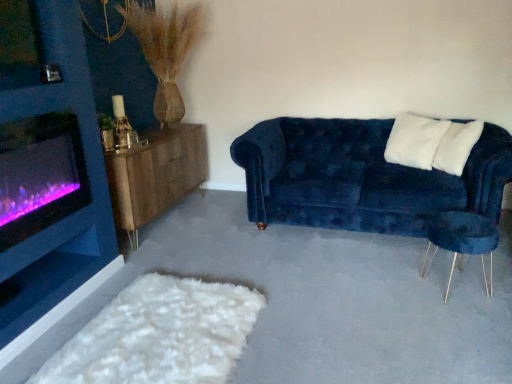
Question: Is velvet blue couch at right not near white soft pillow at upper right, the second pillow positioned from the right?

Choices:
 (A) no
 (B) yes

Answer: (A)

Question: Can you confirm if velvet blue couch at right is taller than white soft pillow at upper right, arranged as the 1th pillow when viewed from the left?

Choices:
 (A) yes
 (B) no

Answer: (A)

Question: Is velvet blue couch at right with white soft pillow at upper right, arranged as the 1th pillow when viewed from the left?

Choices:
 (A) yes
 (B) no

Answer: (B)

Question: Is velvet blue couch at right aimed at white soft pillow at upper right, the second pillow positioned from the right?

Choices:
 (A) yes
 (B) no

Answer: (B)

Question: Is velvet blue couch at right positioned beyond the bounds of white soft pillow at upper right, arranged as the 1th pillow when viewed from the left?

Choices:
 (A) yes
 (B) no

Answer: (A)

Question: Can you confirm if velvet blue couch at right is bigger than white soft pillow at upper right, the second pillow positioned from the right?

Choices:
 (A) no
 (B) yes

Answer: (B)

Question: Does white soft pillow at upper right, the second pillow positioned from the right, have a greater height compared to wooden sideboard at left?

Choices:
 (A) yes
 (B) no

Answer: (B)

Question: From the image's perspective, is white soft pillow at upper right, the second pillow positioned from the right, beneath wooden sideboard at left?

Choices:
 (A) no
 (B) yes

Answer: (A)

Question: From a real-world perspective, does white soft pillow at upper right, the second pillow positioned from the right, sit lower than wooden sideboard at left?

Choices:
 (A) yes
 (B) no

Answer: (B)

Question: Is white soft pillow at upper right, arranged as the 1th pillow when viewed from the left, oriented away from wooden sideboard at left?

Choices:
 (A) no
 (B) yes

Answer: (A)

Question: Is white soft pillow at upper right, the second pillow positioned from the right, at the left side of wooden sideboard at left?

Choices:
 (A) yes
 (B) no

Answer: (B)

Question: Is white soft pillow at upper right, arranged as the 1th pillow when viewed from the left, placed right next to wooden sideboard at left?

Choices:
 (A) yes
 (B) no

Answer: (B)

Question: Is the depth of purple glass wood burning stove at left less than that of velvet blue couch at right?

Choices:
 (A) yes
 (B) no

Answer: (A)